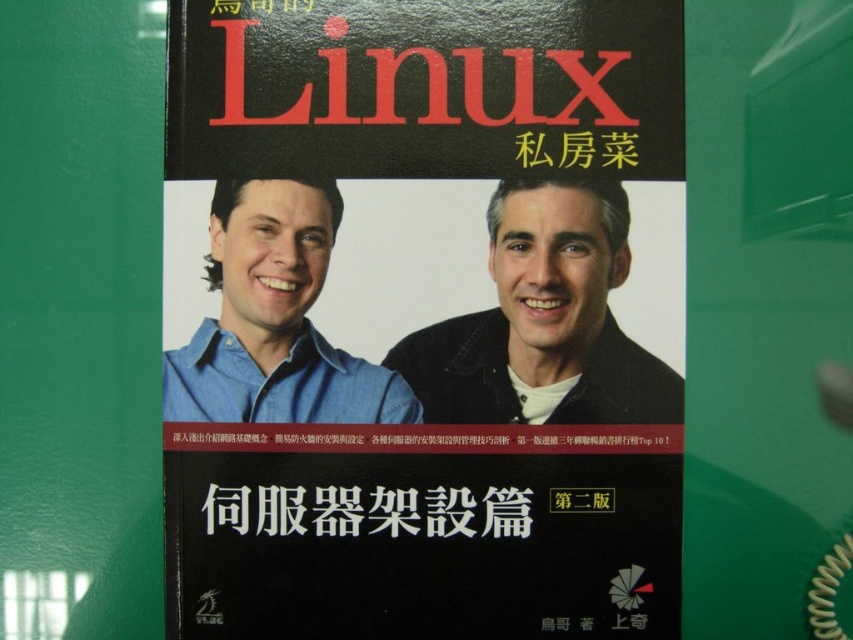
You are designing a layout for a book cover and need to place two points at specific coordinates. The points are located at point (317, 307) and point (286, 220). According to the book cover design, which point is positioned further back in the visual hierarchy?

Point (317, 307) is behind point (286, 220), so it is positioned further back in the visual hierarchy.

You are examining the book cover of Linux Private Dishes. Where is the blue denim shirt at left positioned relative to the other elements on the cover?

The blue denim shirt at left is located at point 0.498 on the horizontal axis and 0.322 on the vertical axis.